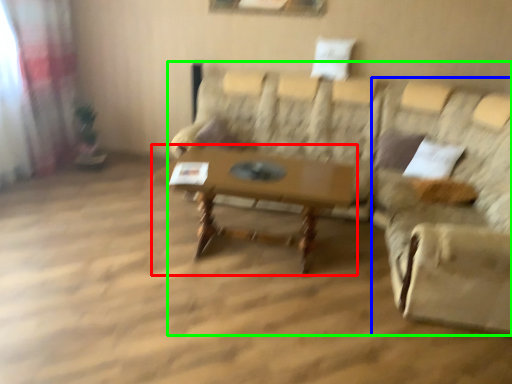
Question: Based on their relative distances, which object is nearer to table (highlighted by a red box)? Choose from swivel chair (highlighted by a blue box) and studio couch (highlighted by a green box).

Choices:
 (A) swivel chair
 (B) studio couch

Answer: (A)